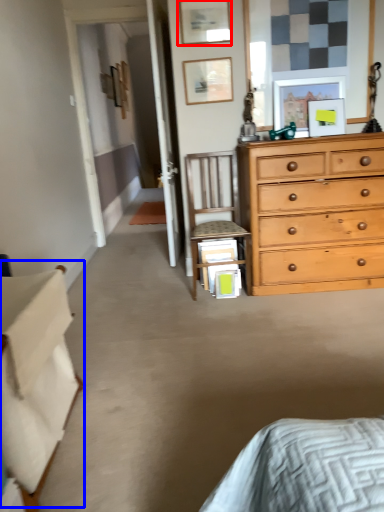
Question: Which point is closer to the camera, picture frame (highlighted by a red box) or table (highlighted by a blue box)?

Choices:
 (A) picture frame
 (B) table

Answer: (B)